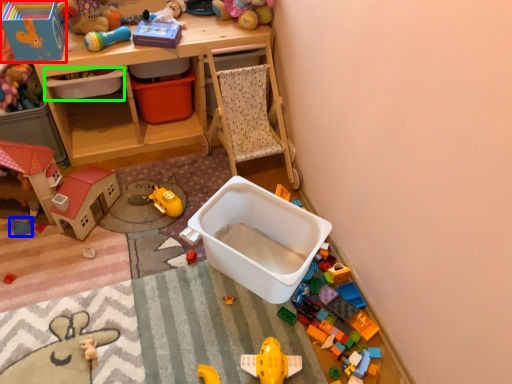
Question: Which is nearer to the toy (highlighted by a red box)? toy (highlighted by a blue box) or storage box (highlighted by a green box).

Choices:
 (A) toy
 (B) storage box

Answer: (B)